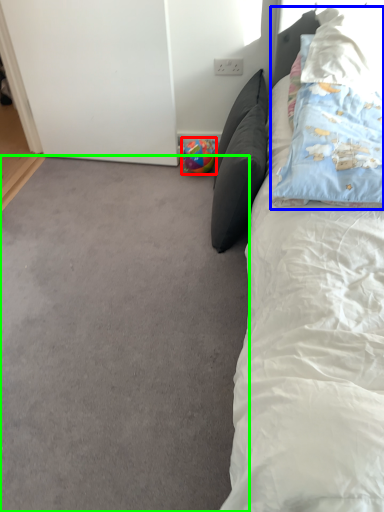
Question: Based on their relative distances, which object is farther from toy (highlighted by a red box)? Choose from pillow (highlighted by a blue box) and plain (highlighted by a green box).

Choices:
 (A) pillow
 (B) plain

Answer: (B)